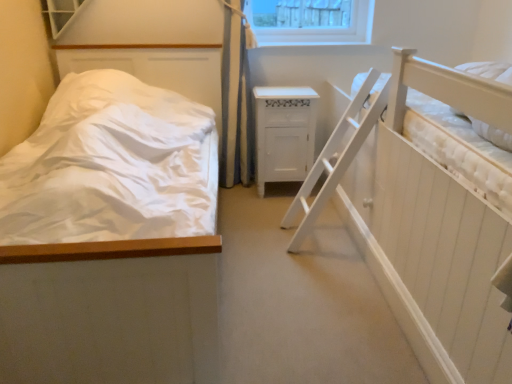
Question: From a real-world perspective, is white textured window at upper left under white wooden hospital bed at right?

Choices:
 (A) no
 (B) yes

Answer: (A)

Question: Is white textured window at upper left completely or partially outside of white wooden hospital bed at right?

Choices:
 (A) yes
 (B) no

Answer: (A)

Question: Is white wooden hospital bed at right at the back of white textured window at upper left?

Choices:
 (A) no
 (B) yes

Answer: (A)

Question: Does white textured window at upper left have a greater width compared to white wooden hospital bed at right?

Choices:
 (A) yes
 (B) no

Answer: (B)

Question: Considering the relative sizes of white textured window at upper left and white wooden hospital bed at right in the image provided, is white textured window at upper left thinner than white wooden hospital bed at right?

Choices:
 (A) yes
 (B) no

Answer: (A)

Question: Does white textured window at upper left contain white wooden hospital bed at right?

Choices:
 (A) yes
 (B) no

Answer: (B)

Question: Can we say white matte bed at left lies outside white textured window at upper left?

Choices:
 (A) no
 (B) yes

Answer: (B)

Question: Can you confirm if white matte bed at left is thinner than white textured window at upper left?

Choices:
 (A) no
 (B) yes

Answer: (A)

Question: Is white matte bed at left far away from white textured window at upper left?

Choices:
 (A) yes
 (B) no

Answer: (A)

Question: Is white matte bed at left further to camera compared to white textured window at upper left?

Choices:
 (A) yes
 (B) no

Answer: (B)

Question: Is white matte bed at left oriented towards white textured window at upper left?

Choices:
 (A) yes
 (B) no

Answer: (B)

Question: Is white matte bed at left positioned in front of white textured window at upper left?

Choices:
 (A) yes
 (B) no

Answer: (A)

Question: Can you confirm if white textured window at upper left is shorter than white matte bed at left?

Choices:
 (A) yes
 (B) no

Answer: (A)